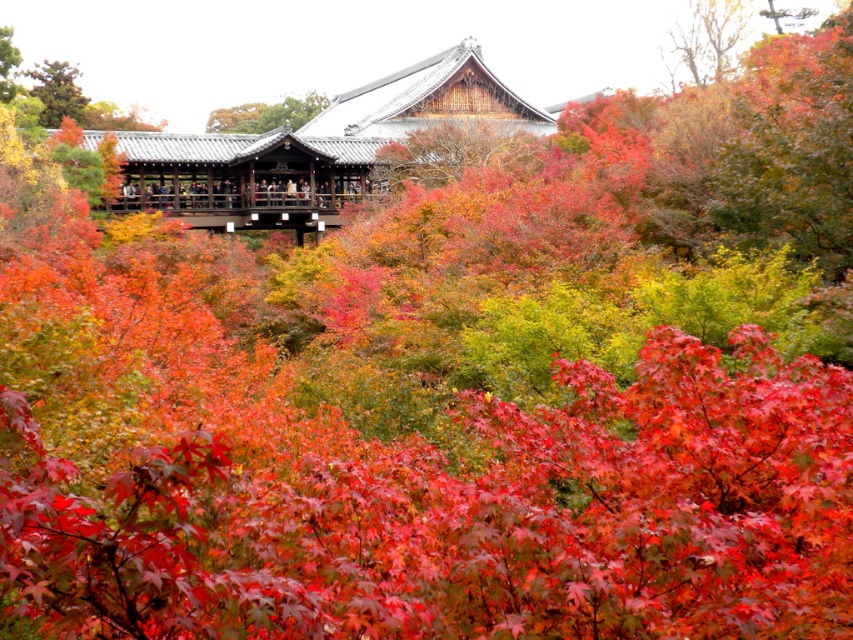
Question: Is smooth brown tree trunk at upper center bigger than smooth dark green tree at upper left?

Choices:
 (A) yes
 (B) no

Answer: (A)

Question: Which of these objects is positioned farthest from the smooth dark green tree at upper left?

Choices:
 (A) smooth brown tree trunk at upper center
 (B) smooth bark tree at upper right

Answer: (B)

Question: Can you confirm if smooth bark tree at upper right is positioned to the left of smooth dark green tree at upper left?

Choices:
 (A) no
 (B) yes

Answer: (A)

Question: Which point is closer to the camera?

Choices:
 (A) smooth bark tree at center
 (B) smooth brown tree trunk at upper center
 (C) smooth bark tree at upper right

Answer: (A)

Question: Does smooth bark tree at center lie behind smooth bark tree at upper right?

Choices:
 (A) yes
 (B) no

Answer: (B)

Question: Which of these objects is positioned closest to the smooth bark tree at center?

Choices:
 (A) smooth brown tree trunk at upper center
 (B) smooth dark green tree at upper left

Answer: (B)